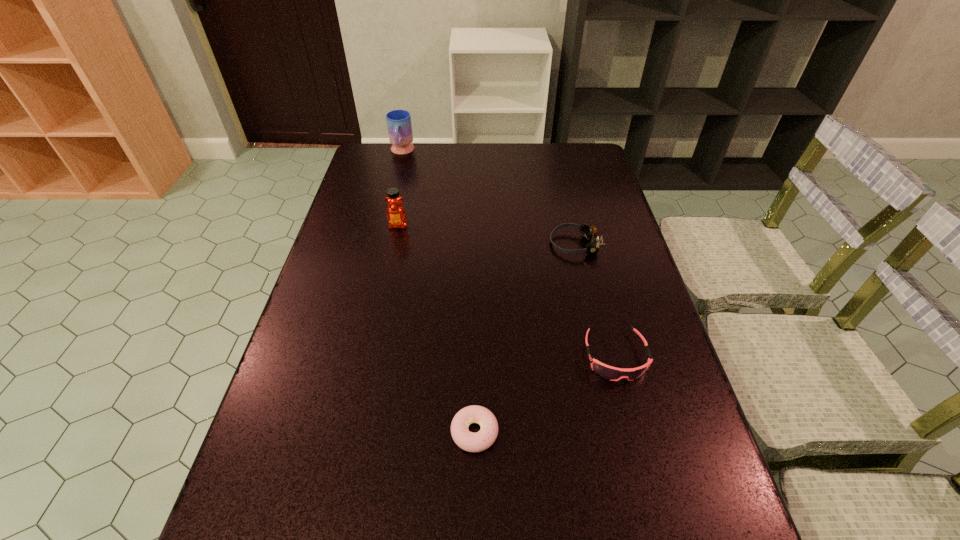
What are the coordinates of `free location located through the lenses of the farther goggles` in the screenshot? It's located at (436, 244).

The image size is (960, 540). Identify the location of vacant space situated on the front-facing side of the fourth farthest object. (656, 511).

This screenshot has width=960, height=540. I want to click on vacant space located on the left of the third object from right to left, so click(368, 432).

The width and height of the screenshot is (960, 540). What are the coordinates of `object present at the far edge` in the screenshot? It's located at (399, 125).

I want to click on mug positioned at the left edge, so click(x=399, y=125).

Identify the location of honey located in the left edge section of the desktop. (396, 215).

Locate an element on the screen. This screenshot has height=540, width=960. object that is positioned at the far left corner is located at coordinates (399, 125).

Find the location of a particular element. This screenshot has height=540, width=960. vacant space at the far edge of the desktop is located at coordinates (531, 170).

The width and height of the screenshot is (960, 540). In order to click on vacant space at the left edge of the desktop in this screenshot , I will do `click(365, 213)`.

Locate an element on the screen. Image resolution: width=960 pixels, height=540 pixels. vacant space at the right edge is located at coordinates (679, 434).